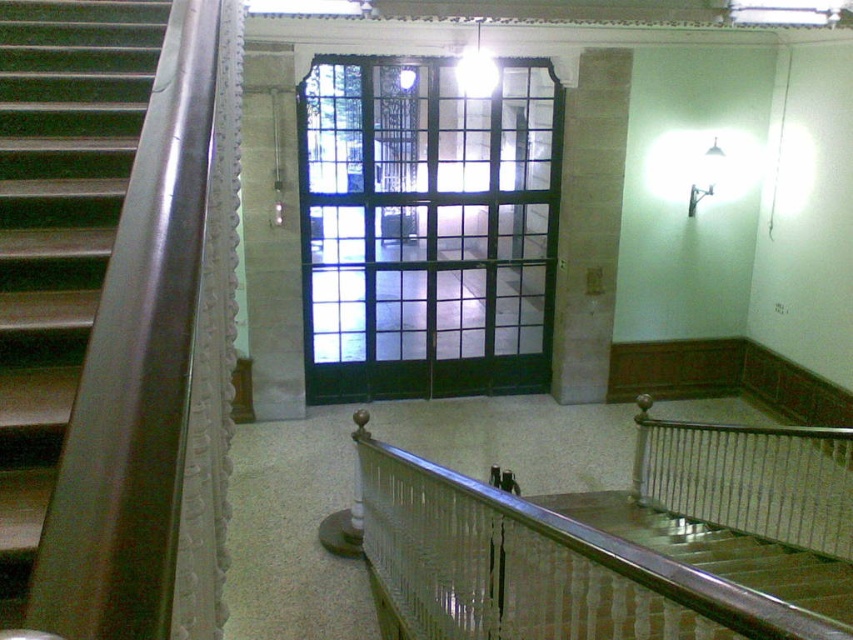
You are a delivery person trying to enter the building through the black glass door at center. However, you notice a gray stone pillar at center nearby. Considering their sizes, which object would you need to maneuver around to access the door?

The black glass door at center has a larger size compared to the gray stone pillar at center. Since the door is larger, you would need to maneuver around the smaller gray stone pillar at center to access the black glass door at center.

You are standing at the bottom of the staircase in this building. You want to locate the metallic polished handrail at lower center. Based on its 2D coordinates, where should you look relative to the windows?

The metallic polished handrail at lower center is located at coordinates 0.887 on the x axis and 0.626 on the y axis, which places it to the right side of the windows since the x value is closer to 1.0, indicating a position further to the right in the image.